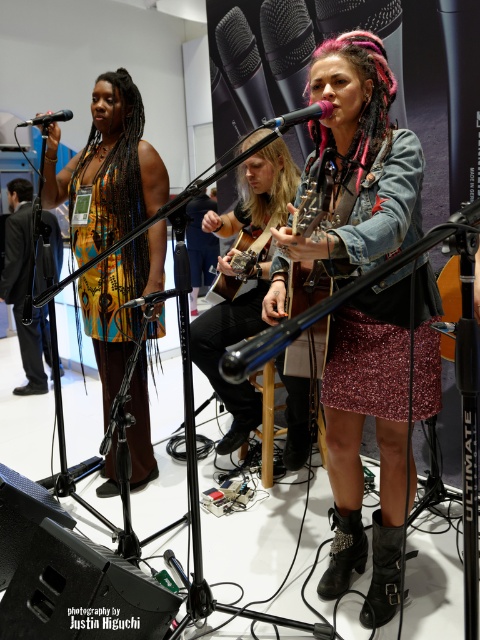
You are a photographer at the event and need to capture a clear shot of both the printed fabric dress at center and the metallic silver microphone at center. Which object should you focus on first if you want to ensure it appears larger in the photo?

The printed fabric dress at center is taller than the metallic silver microphone at center, so focusing on the printed fabric dress at center first will ensure it appears larger in the photo.